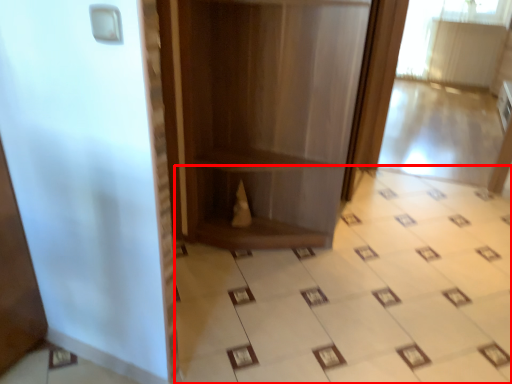
Question: From the image's perspective, where is ceramic tile (annotated by the red box) located in relation to bookshelf in the image?

Choices:
 (A) below
 (B) above

Answer: (A)